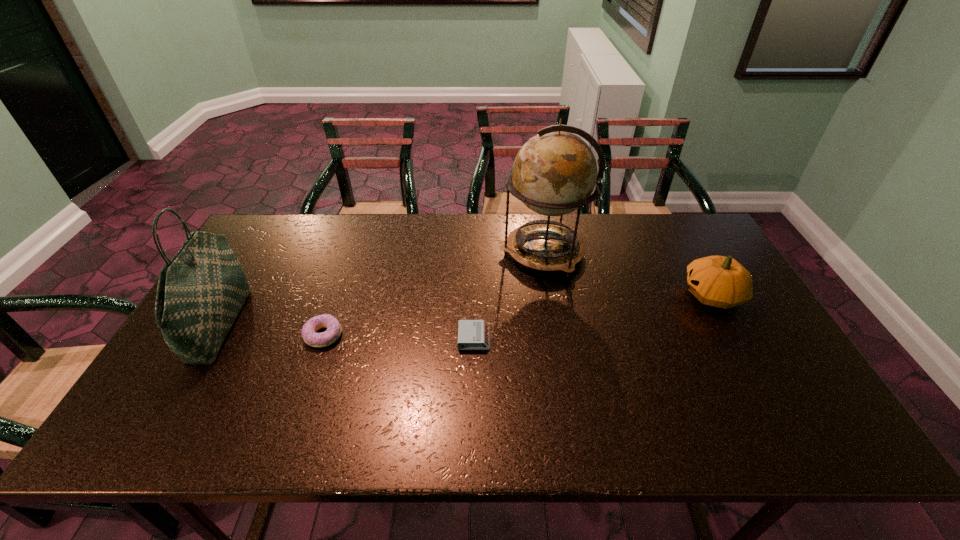
Locate an element on the screen. free space that satisfies the following two spatial constraints: 1. on the side of the third shortest object with the carved face; 2. on the front side of the tote bag is located at coordinates (729, 324).

The width and height of the screenshot is (960, 540). In order to click on vacant space that satisfies the following two spatial constraints: 1. on the side of the gourd with the carved face; 2. on the front side of the leftmost object in this screenshot , I will do [729, 324].

The width and height of the screenshot is (960, 540). Identify the location of free spot that satisfies the following two spatial constraints: 1. on the side of the gourd with the carved face; 2. on the front side of the third object from right to left. pos(736,339).